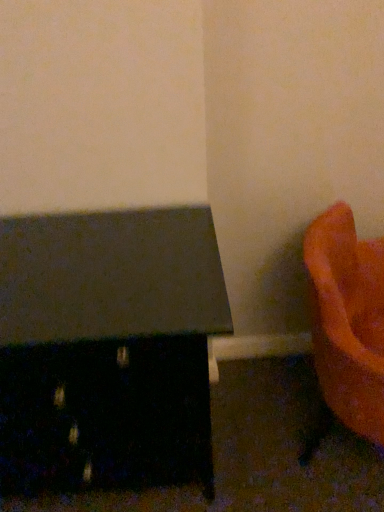
Locate an element on the screen. Image resolution: width=384 pixels, height=512 pixels. vacant space situated above matte black table at left, the first furniture in the left-to-right sequence (from a real-world perspective) is located at coordinates (89, 264).